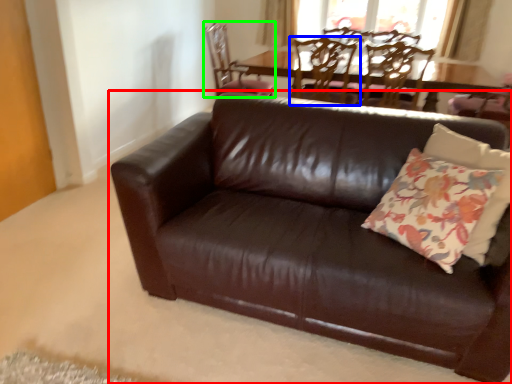
Question: Which object is the closest to the studio couch (highlighted by a red box)? Choose among these: chair (highlighted by a blue box) or chair (highlighted by a green box).

Choices:
 (A) chair
 (B) chair

Answer: (A)